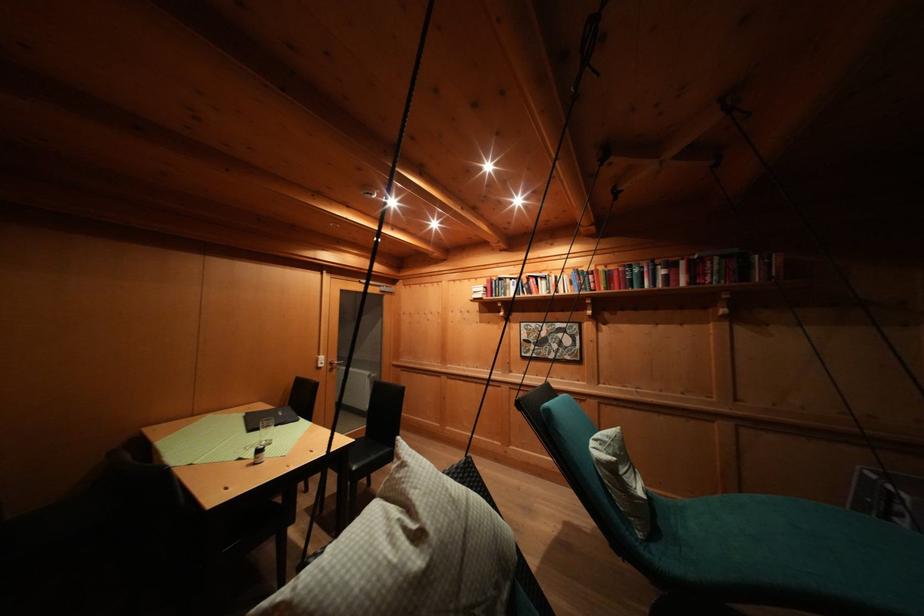
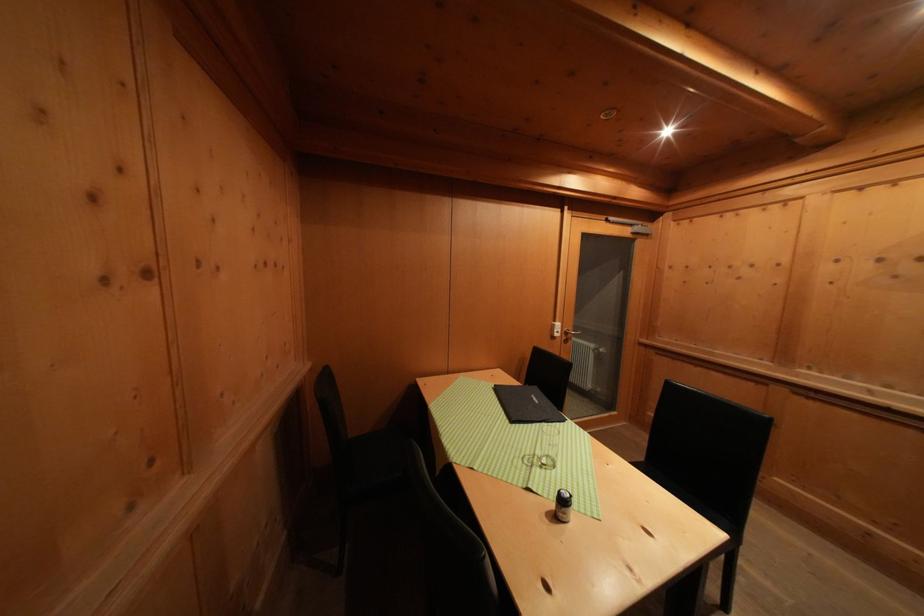
The point at [264,456] is marked in the first image. Where is the corresponding point in the second image?

(569, 506)